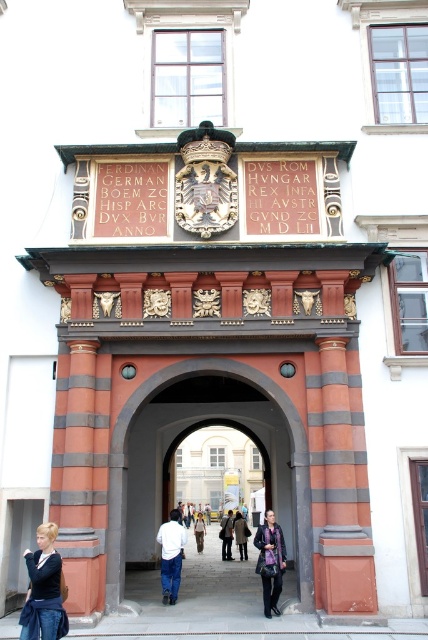
Question: Does denim jacket at lower left have a larger size compared to dark purple scarf at center?

Choices:
 (A) yes
 (B) no

Answer: (B)

Question: Which of these objects is positioned closest to the white cotton shirt at center?

Choices:
 (A) denim jacket at lower left
 (B) smooth stone archway at center
 (C) light brown leather jacket at center
 (D) terracotta striped column at lower left

Answer: (B)

Question: Is terracotta brick pillar at right below dark purple scarf at center?

Choices:
 (A) no
 (B) yes

Answer: (A)

Question: Which object is positioned closest to the white cotton shirt at center?

Choices:
 (A) light brown leather coat at center
 (B) denim jacket at lower left
 (C) dark brown leather jacket at center
 (D) dark purple scarf at center

Answer: (D)

Question: Does gold metallic writing at upper center come in front of light brown leather jacket at center?

Choices:
 (A) yes
 (B) no

Answer: (A)

Question: Which point appears closest to the camera in this image?

Choices:
 (A) (336, 468)
 (B) (59, 588)

Answer: (B)